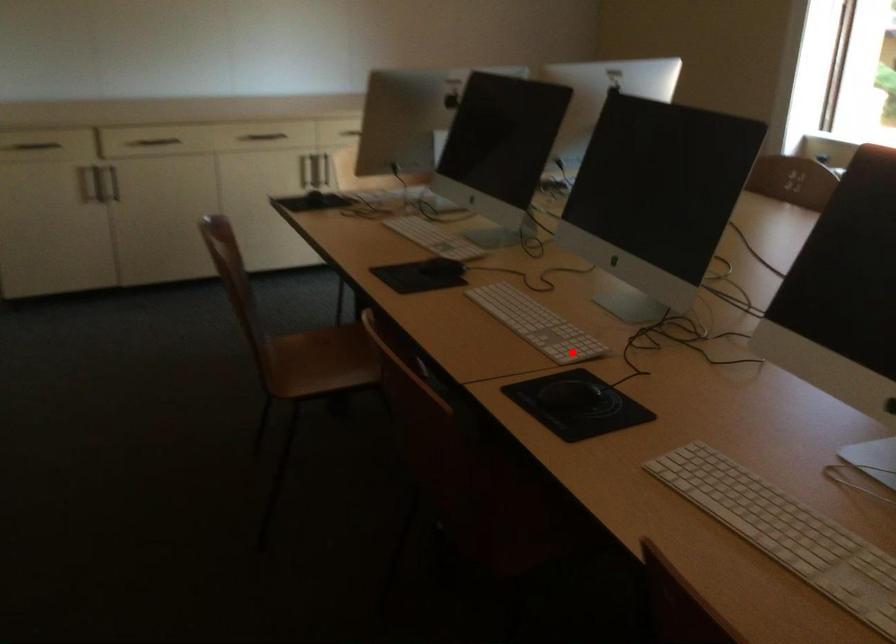
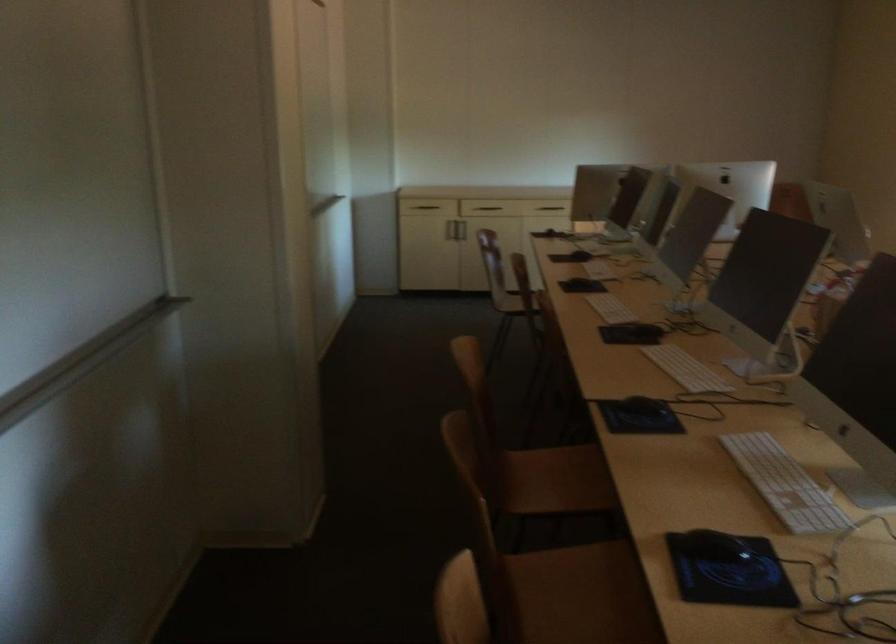
Question: I am providing you with two images of the same scene from different viewpoints. Image1 has a red point marked. In image2, the corresponding 3D location appears at what relative position? Reply with the corresponding letter.

Choices:
 (A) Closer
 (B) Farther

Answer: (B)